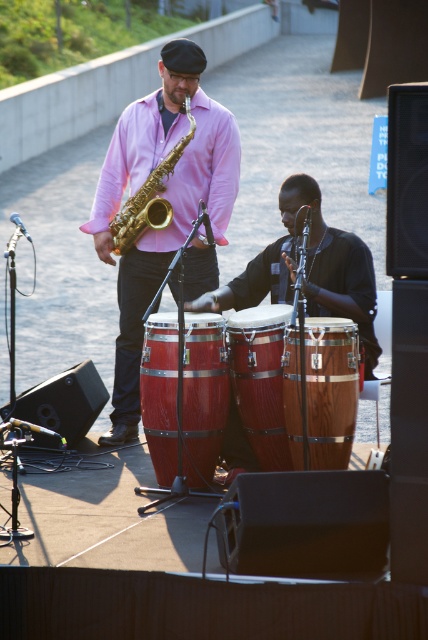
You are a photographer at the live music performance. You want to capture a photo that includes both the matte gold saxophone at center and the gold shiny trumpet at center. Which instrument should you position closer to the camera to ensure both are in focus?

The matte gold saxophone at center is in front of the gold shiny trumpet at center, so positioning the camera closer to the matte gold saxophone at center will keep both in focus as the saxophone is already closer to the viewer.

You are a photographer at the live music performance. You want to take a photo that includes both the wooden bongo drums at center and the gold shiny trumpet at center. Which object will appear larger in the photo?

The wooden bongo drums at center will appear larger in the photo because they are closer to the viewer than the gold shiny trumpet at center.